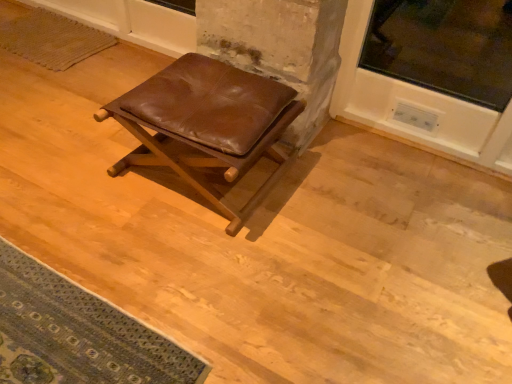
Find the location of a particular element. The image size is (512, 384). free location to the right of brown leather stool at center is located at coordinates [332, 196].